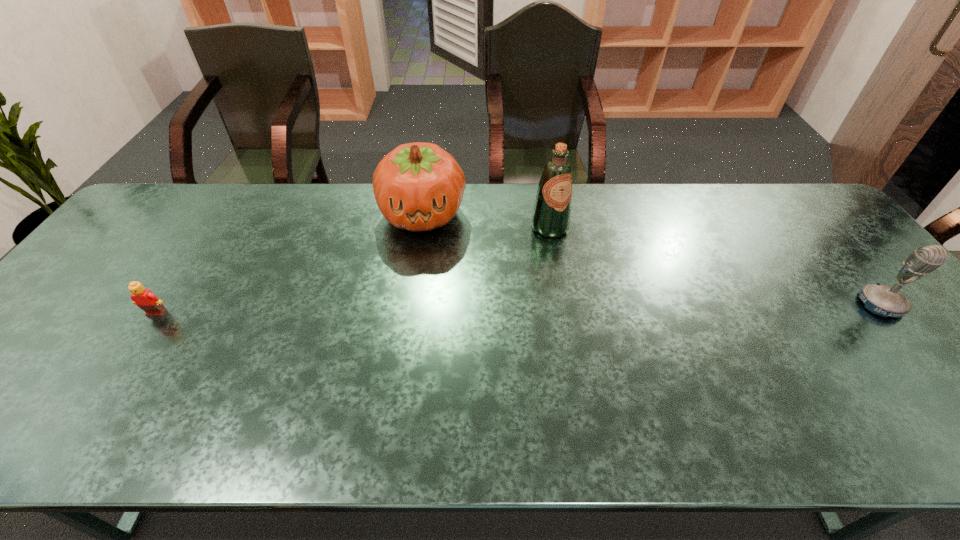
Image resolution: width=960 pixels, height=540 pixels. In the image, there is a desktop. What are the coordinates of `vacant space at the right edge` in the screenshot? It's located at (837, 302).

Find the location of `free space at the far left corner of the desktop`. free space at the far left corner of the desktop is located at coordinates (205, 188).

Locate an element on the screen. Image resolution: width=960 pixels, height=540 pixels. vacant space at the near left corner of the desktop is located at coordinates (16, 370).

Locate an element on the screen. blank region between the olive oil and the pumpkin is located at coordinates (486, 221).

At what (x,y) coordinates should I click in order to perform the action: click on free space between the olive oil and the leftmost object. Please return your answer as a coordinate pair (x, y). The image size is (960, 540). Looking at the image, I should click on (353, 271).

The height and width of the screenshot is (540, 960). Identify the location of free space that is in between the rightmost object and the second object from left to right. (652, 259).

The image size is (960, 540). Identify the location of free space between the second object from right to left and the rightmost object. (715, 266).

Where is `free space between the Lego and the third tallest object`? This screenshot has height=540, width=960. free space between the Lego and the third tallest object is located at coordinates (518, 309).

At what (x,y) coordinates should I click in order to perform the action: click on unoccupied area between the second shortest object and the shortest object. Please return your answer as a coordinate pair (x, y). Looking at the image, I should click on (518, 309).

The width and height of the screenshot is (960, 540). I want to click on vacant area that lies between the shortest object and the microphone, so click(518, 309).